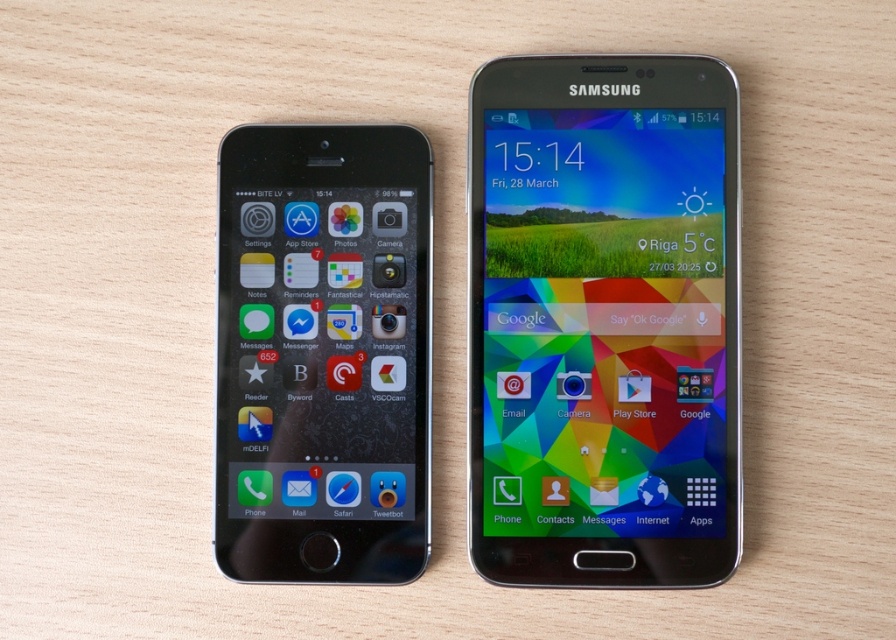
Who is lower down, metallic samsung smartphone at center or matte black phone at left?

matte black phone at left

Who is positioned more to the left, metallic samsung smartphone at center or matte black phone at left?

matte black phone at left

Locate an element on the screen. The width and height of the screenshot is (896, 640). metallic samsung smartphone at center is located at coordinates [x=602, y=321].